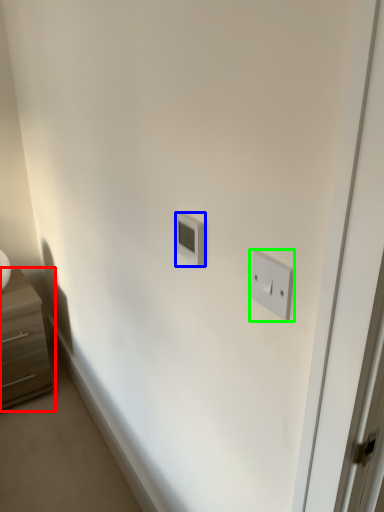
Question: Which object is positioned closest to chest of drawers (highlighted by a red box)? Select from light switch (highlighted by a blue box) and light switch (highlighted by a green box).

Choices:
 (A) light switch
 (B) light switch

Answer: (A)